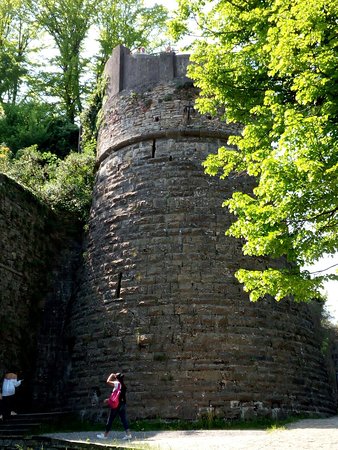
I want to click on window, so click(x=118, y=284).